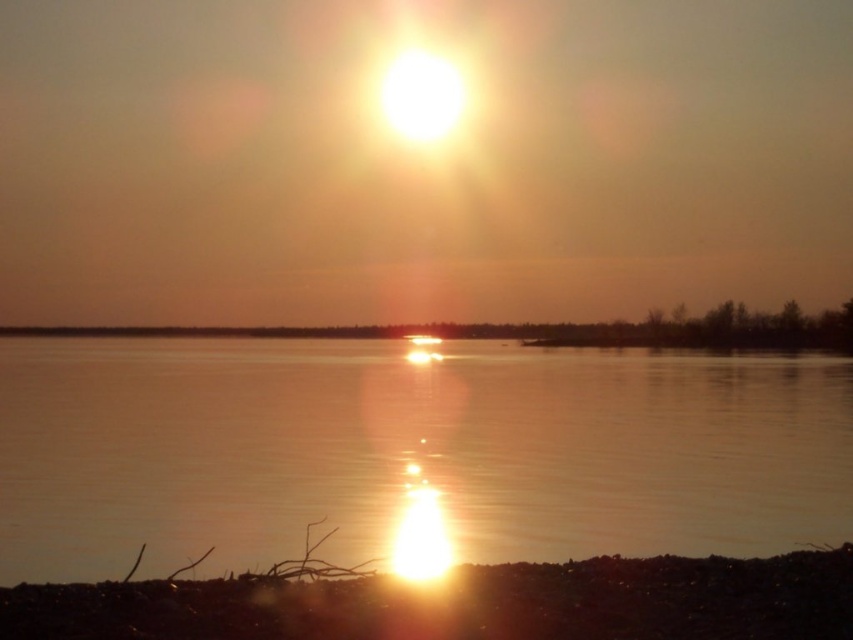
Can you confirm if translucent water at center is thinner than smooth sand at center?

Indeed, translucent water at center has a lesser width compared to smooth sand at center.

Which is below, translucent water at center or smooth sand at center?

translucent water at center is below.

Identify the location of translucent water at center. The image size is (853, 640). (409, 451).